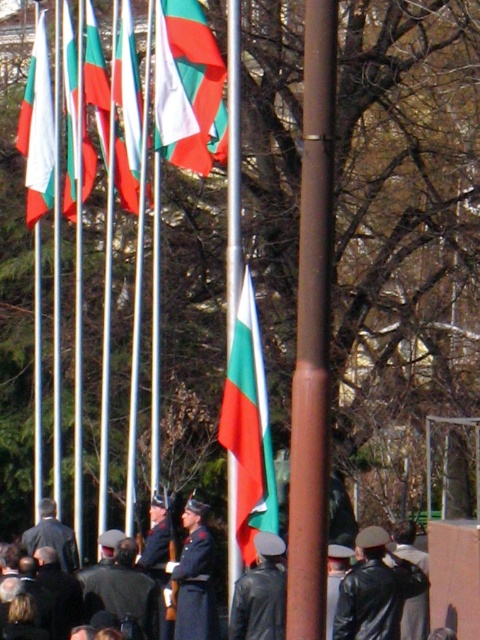
Question: Can you confirm if green and white striped flag at center is bigger than black leather uniform at center?

Choices:
 (A) no
 (B) yes

Answer: (A)

Question: Which point is farther from the camera taking this photo?

Choices:
 (A) (100, 579)
 (B) (39, 515)

Answer: (B)

Question: Which point is closer to the camera?

Choices:
 (A) (305, 449)
 (B) (337, 628)
 (C) (39, 19)

Answer: (A)

Question: Considering the relative positions of brown polished pole at center and leather jacket at lower right in the image provided, where is brown polished pole at center located with respect to leather jacket at lower right?

Choices:
 (A) above
 (B) below

Answer: (A)

Question: Which point is closer to the camera taking this photo?

Choices:
 (A) (256, 605)
 (B) (388, 560)

Answer: (A)

Question: Does green and white striped flag at center lie behind leather jacket at lower right?

Choices:
 (A) yes
 (B) no

Answer: (A)